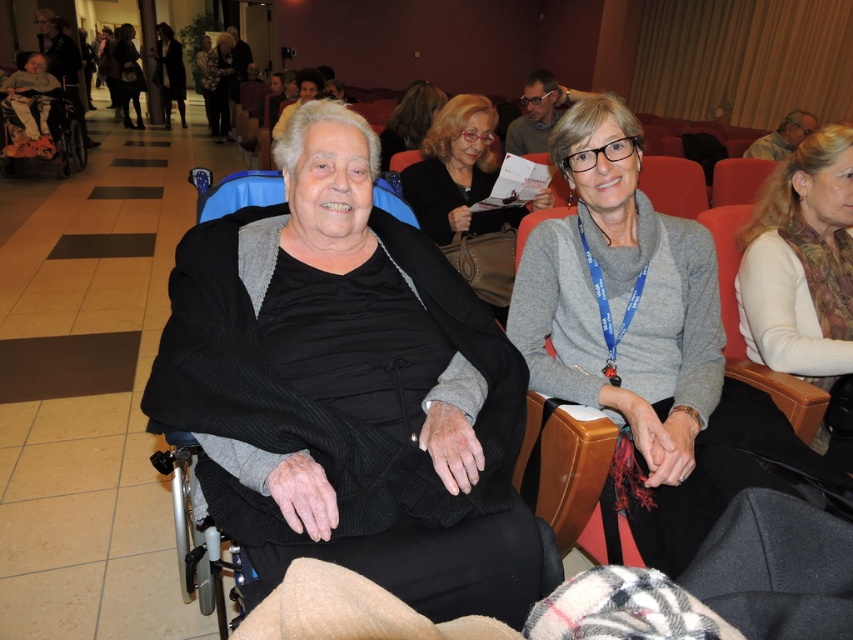
What object is located at the coordinates point [349,388] in the image?

The point [349,388] indicates the location of the black knit sweater at center.

From the picture: You are organizing a photoshoot and need to place two mannequins wearing the matte gray sweater at center and the matte black dress at center. According to the scene, which item should be placed to the right of the other?

The matte gray sweater at center should be placed to the right of the matte black dress at center.